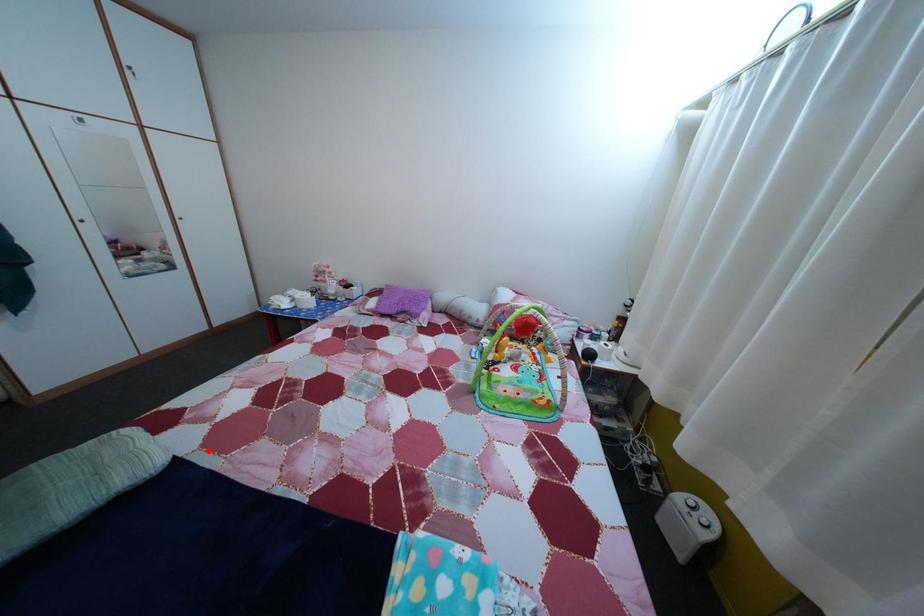
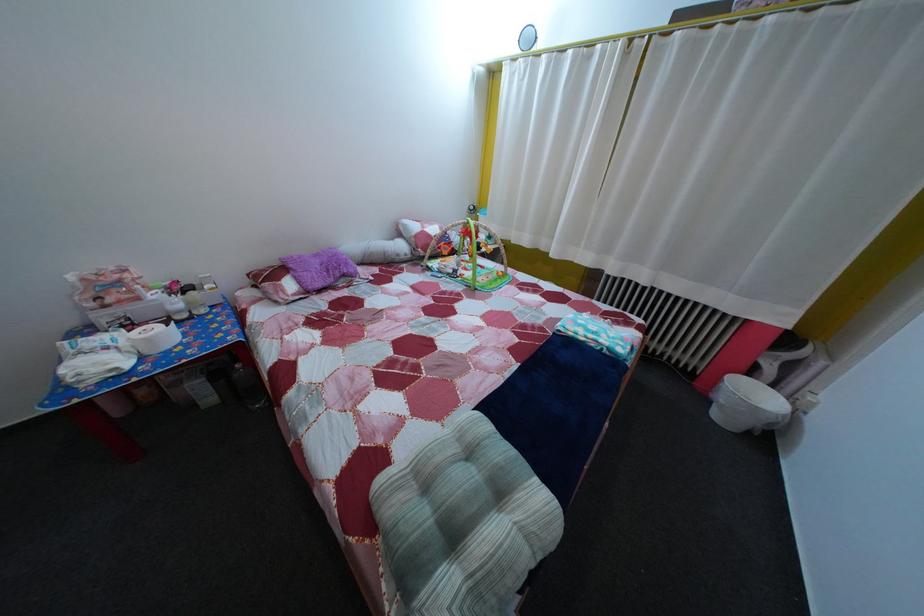
In the second image, find the point that corresponds to the highlighted location in the first image.

(442, 432)